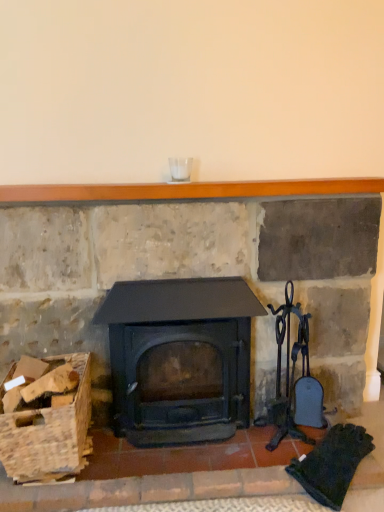
Find the location of `vacant space in matte black wood burning stove at center (from a real-world perspective)`. vacant space in matte black wood burning stove at center (from a real-world perspective) is located at coordinates (192, 442).